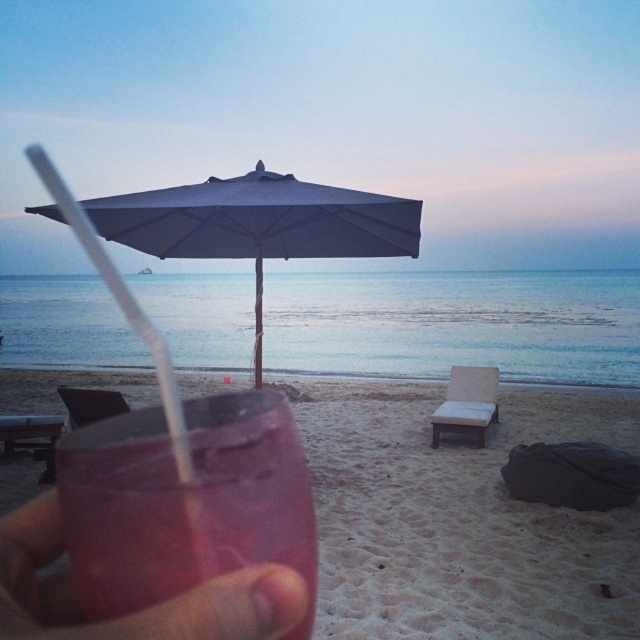
Question: Among these points, which one is farthest from the camera?

Choices:
 (A) (298, 205)
 (B) (449, 554)
 (C) (33, 636)
 (D) (113, 278)

Answer: (D)

Question: Does gray fabric umbrella at center have a lesser width compared to pink matte cup at lower left?

Choices:
 (A) no
 (B) yes

Answer: (A)

Question: Which point is farther from the camera taking this photo?

Choices:
 (A) (625, 410)
 (B) (172, 417)
 (C) (305, 218)
 (D) (32, 579)

Answer: (A)

Question: Which object is positioned farthest from the pink matte cup at lower left?

Choices:
 (A) sandy beige at lower center
 (B) transparent plastic straw at lower left
 (C) gray fabric umbrella at center

Answer: (B)

Question: Can you confirm if sandy beige at lower center is smaller than transparent plastic straw at lower left?

Choices:
 (A) no
 (B) yes

Answer: (B)

Question: In this image, where is gray fabric umbrella at center located relative to pink matte cup at lower left?

Choices:
 (A) right
 (B) left

Answer: (B)